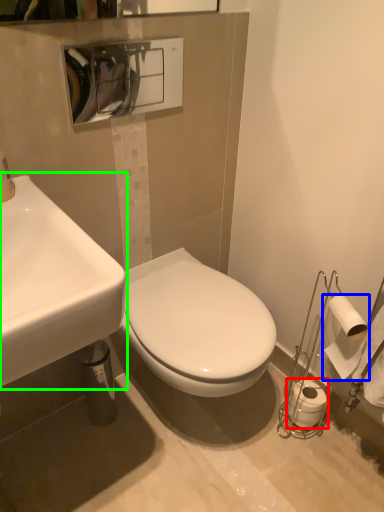
Question: Which is farther away from toilet paper (highlighted by a red box)? toilet paper (highlighted by a blue box) or sink (highlighted by a green box)?

Choices:
 (A) toilet paper
 (B) sink

Answer: (B)